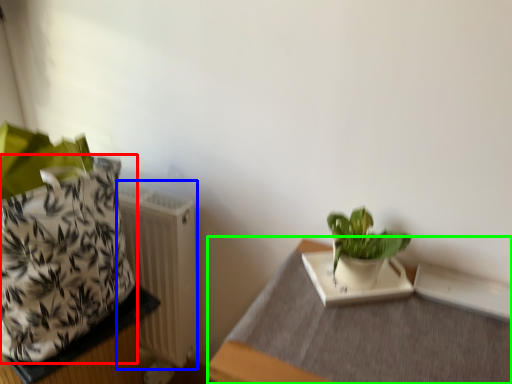
Question: Which is nearer to the flowerpot (highlighted by a red box)? radiator (highlighted by a blue box) or table (highlighted by a green box).

Choices:
 (A) radiator
 (B) table

Answer: (A)